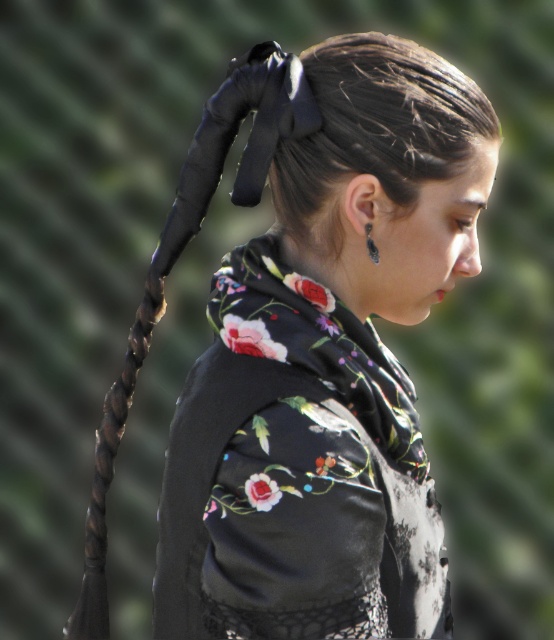
Question: Considering the real-world distances, which object is closest to the silver metallic earring at ear?

Choices:
 (A) black satin bow at center
 (B) black glossy hair braid at left

Answer: (A)

Question: Can you confirm if floral satin dress at center is positioned below black satin bow at center?

Choices:
 (A) yes
 (B) no

Answer: (A)

Question: Does black glossy hair braid at left have a greater width compared to silver metallic earring at ear?

Choices:
 (A) yes
 (B) no

Answer: (A)

Question: Where is floral satin dress at center located in relation to black glossy hair braid at left in the image?

Choices:
 (A) left
 (B) right

Answer: (B)

Question: Which point is closer to the camera?

Choices:
 (A) pos(373,262)
 (B) pos(325,515)

Answer: (B)

Question: Considering the real-world distances, which object is closest to the black glossy hair braid at left?

Choices:
 (A) floral satin dress at center
 (B) silver metallic earring at ear
 (C) black satin bow at center

Answer: (C)